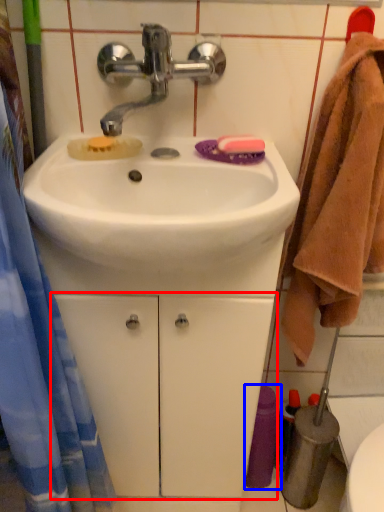
Question: Which object is further to the camera taking this photo, drawer (highlighted by a red box) or toiletry (highlighted by a blue box)?

Choices:
 (A) drawer
 (B) toiletry

Answer: (B)